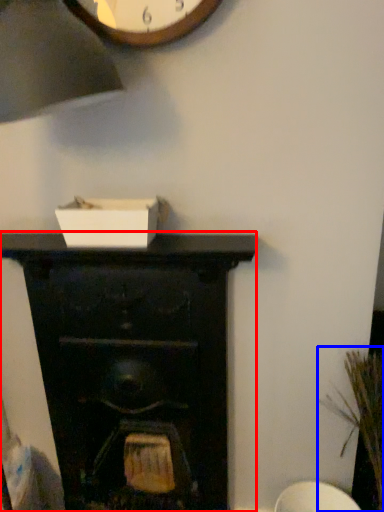
Question: Among these objects, which one is nearest to the camera, fireplace (highlighted by a red box) or plant (highlighted by a blue box)?

Choices:
 (A) fireplace
 (B) plant

Answer: (B)